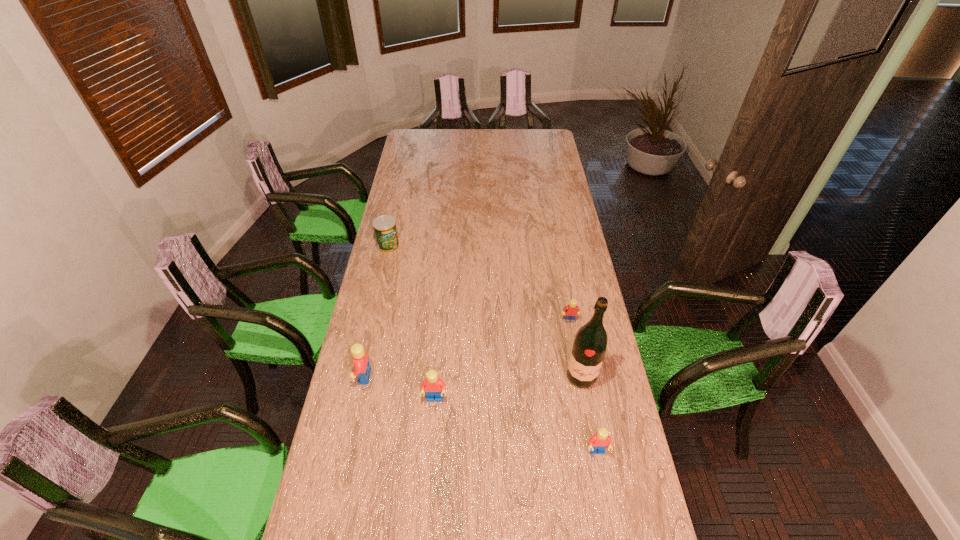
The image size is (960, 540). I want to click on vacant area between the fourth object from right to left and the second farthest object, so click(x=502, y=360).

Locate an element on the screen. free point between the can and the leftmost Lego is located at coordinates (376, 311).

Locate an element on the screen. Image resolution: width=960 pixels, height=540 pixels. vacant area that lies between the can and the leftmost Lego is located at coordinates (376, 311).

Find the location of a particular element. Image resolution: width=960 pixels, height=540 pixels. vacant space in between the third Lego from right to left and the second farthest object is located at coordinates click(502, 360).

Identify the location of blank region between the tallest object and the third nearest Lego. This screenshot has height=540, width=960. (x=472, y=377).

Image resolution: width=960 pixels, height=540 pixels. Find the location of `vacant space that is in between the tallest object and the second farthest Lego`. vacant space that is in between the tallest object and the second farthest Lego is located at coordinates (472, 377).

Where is `free spot between the tallest object and the nearest Lego`? This screenshot has width=960, height=540. free spot between the tallest object and the nearest Lego is located at coordinates (588, 414).

Identify which object is located as the fifth nearest to the third object from left to right. Please provide its 2D coordinates. Your answer should be formatted as a tuple, i.e. [(x, y)], where the tuple contains the x and y coordinates of a point satisfying the conditions above.

[(385, 230)]

Locate which object is the closest to the can. Please provide its 2D coordinates. Your answer should be formatted as a tuple, i.e. [(x, y)], where the tuple contains the x and y coordinates of a point satisfying the conditions above.

[(361, 362)]

Locate an element on the screen. This screenshot has height=540, width=960. the second closest Lego to the third object from left to right is located at coordinates (599, 441).